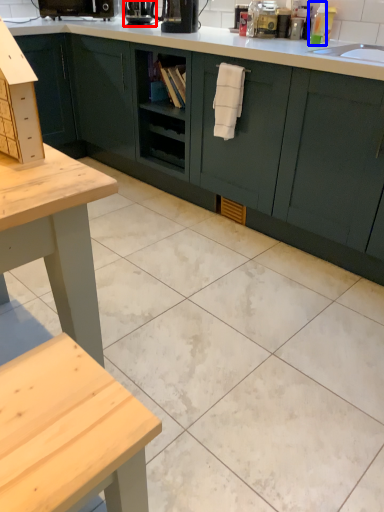
Question: Among these objects, which one is nearest to the camera, coffee machine (highlighted by a red box) or toiletry (highlighted by a blue box)?

Choices:
 (A) coffee machine
 (B) toiletry

Answer: (B)